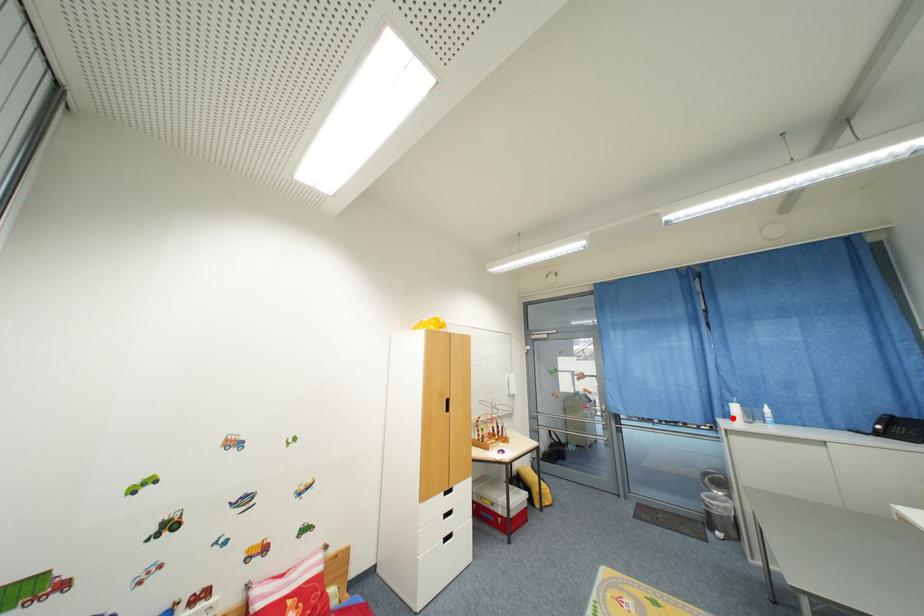
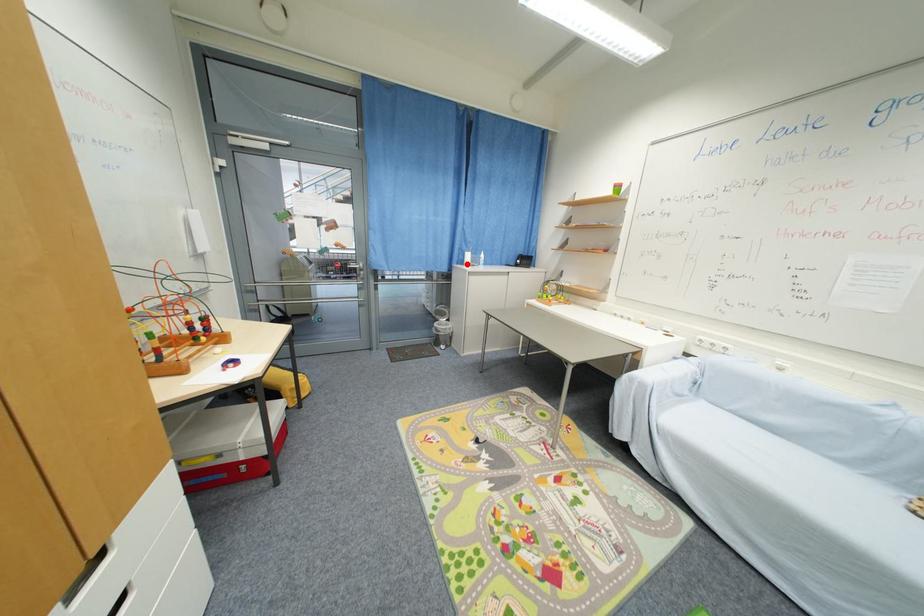
I am providing you with two images of the same scene from different viewpoints. A red point is marked on the first image and another point is marked on the second image. Is the marked point in image1 the same physical position as the marked point in image2?

Yes